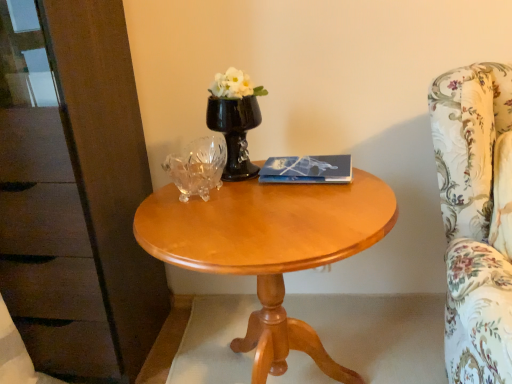
Locate an element on the screen. The image size is (512, 384). vacant space in front of black glass vase at center is located at coordinates (268, 197).